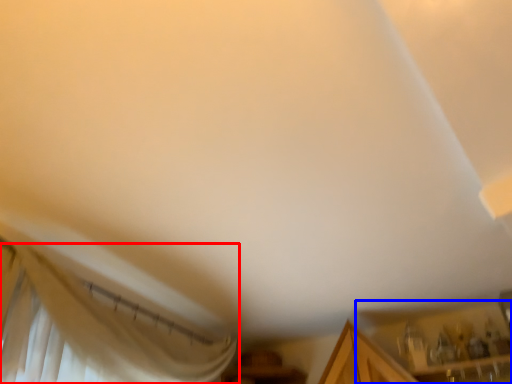
Question: Which object appears farthest to the camera in this image, curtain (highlighted by a red box) or cabinetry (highlighted by a blue box)?

Choices:
 (A) curtain
 (B) cabinetry

Answer: (B)